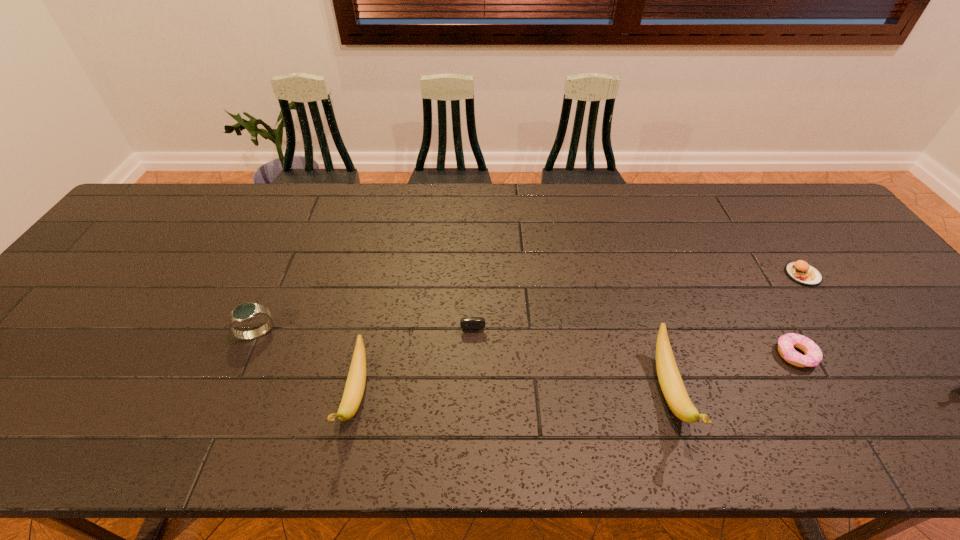
This screenshot has width=960, height=540. Identify the location of vacant spot to place a banana on the left. (39, 397).